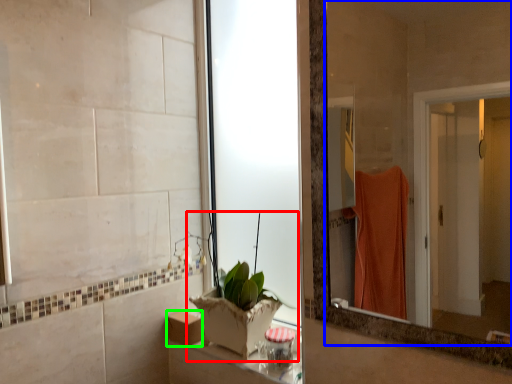
Question: Based on their relative distances, which object is farther from houseplant (highlighted by a red box)? Choose from mirror (highlighted by a blue box) and box (highlighted by a green box).

Choices:
 (A) mirror
 (B) box

Answer: (A)